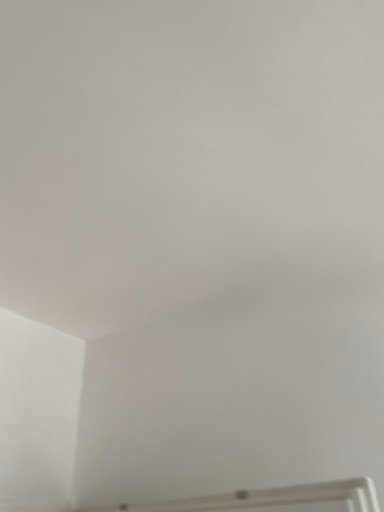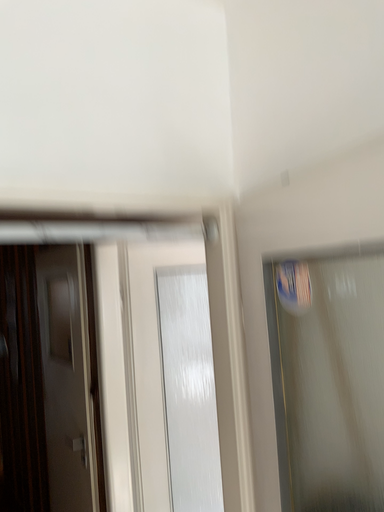
Question: How did the camera likely rotate when shooting the video?

Choices:
 (A) rotated downward
 (B) rotated upward

Answer: (A)